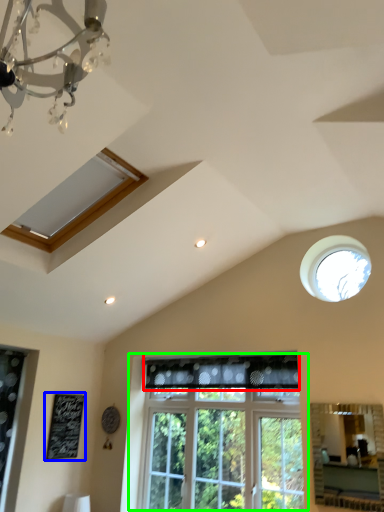
Question: Which object is positioned farthest from curtain (highlighted by a red box)? Select from bulletin board (highlighted by a blue box) and window (highlighted by a green box).

Choices:
 (A) bulletin board
 (B) window

Answer: (A)